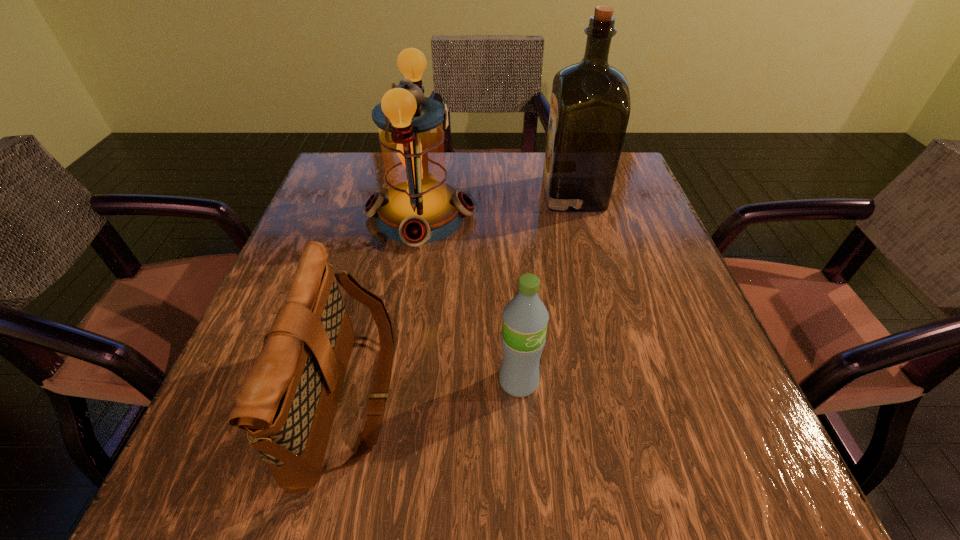
Find the location of a particular element. the tallest object is located at coordinates (590, 106).

I want to click on liquor, so click(590, 106).

The width and height of the screenshot is (960, 540). What are the coordinates of `lantern` in the screenshot? It's located at (418, 207).

I want to click on water bottle, so click(525, 317).

This screenshot has height=540, width=960. I want to click on shoulder bag, so point(287,403).

At what (x,y) coordinates should I click in order to perform the action: click on free region located 0.090m on the label of the rightmost object. Please return your answer as a coordinate pair (x, y). Looking at the image, I should click on (507, 194).

At what (x,y) coordinates should I click in order to perform the action: click on vacant space located 0.310m on the label of the rightmost object. Please return your answer as a coordinate pair (x, y). The height and width of the screenshot is (540, 960). Looking at the image, I should click on (414, 194).

Locate an element on the screen. vacant space positioned on the label of the rightmost object is located at coordinates (397, 194).

In order to click on free space located on the front-facing side of the lantern in this screenshot , I will do `click(556, 216)`.

This screenshot has height=540, width=960. Find the location of `vacant space located 0.180m on the right of the third object from left to right`. vacant space located 0.180m on the right of the third object from left to right is located at coordinates (656, 382).